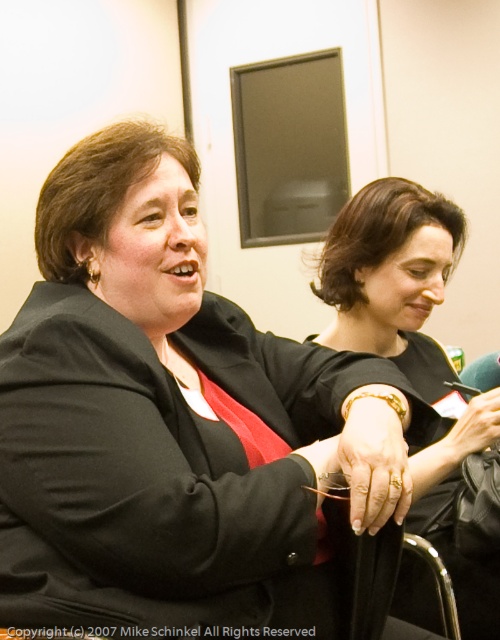
You are a photographer trying to capture a candid shot of the black matte dress at center and the metallic silver chair at lower right. Based on their positions, which object is closer to the right edge of the frame?

The black matte dress at center is positioned on the right side of the metallic silver chair at lower right, so the black matte dress at center is closer to the right edge of the frame.

You are standing at the camera position and want to reach point [429,243]. Can you walk directly to it without moving any objects?

The distance between point [429,243] and the camera is 1.57 meters. Since there are no objects mentioned blocking the path, you can walk directly to it without moving any objects.

You are a fashion designer observing the scene. You need to decide whether the black matte dress at center can be placed on the metallic silver chair at lower right without touching the floor. Based on their heights, what do you think?

The black matte dress at center has a greater height compared to the metallic silver chair at lower right. Since the dress is taller than the chair, placing it on the chair would cause the dress to extend beyond the chair, potentially touching the floor depending on the chair height. However, the question is about placing the dress on the chair without touching the floor. Since the dress is taller than the chair, it might not fit properly, so it might touch the floor. Therefore, the dress cannot be placed.